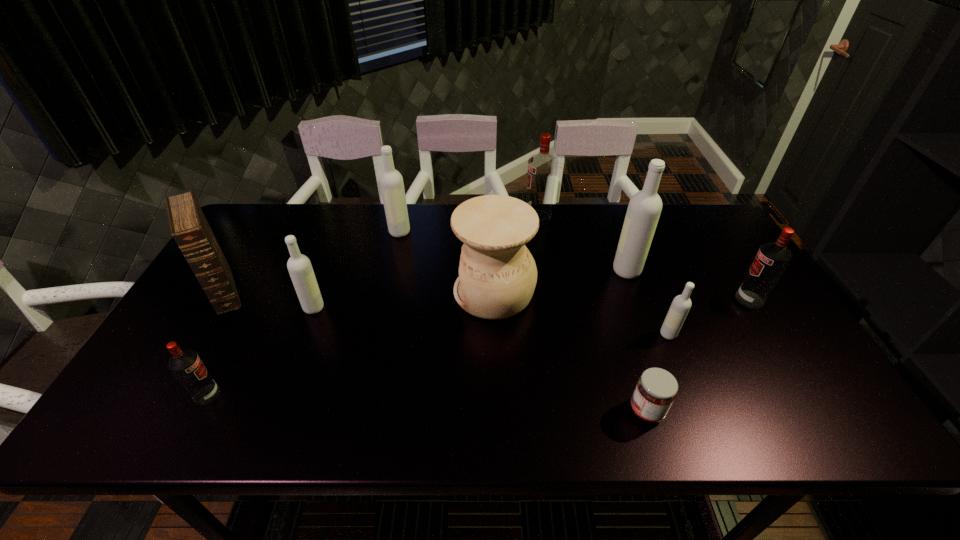
Locate an element on the screen. Image resolution: width=960 pixels, height=540 pixels. vacant region located on the front label of the fourth vodka from left to right is located at coordinates (447, 218).

The height and width of the screenshot is (540, 960). I want to click on free space located 0.090m on the front label of the fourth vodka from left to right, so click(x=497, y=218).

Find the location of a particular element. free space located 0.340m on the left of the seventh object from right to left is located at coordinates (285, 232).

Identify the location of vacant space situated on the back of the Bible. The height and width of the screenshot is (540, 960). (267, 220).

Locate an element on the screen. The width and height of the screenshot is (960, 540). vacant space located at the open side of the pottery is located at coordinates (369, 292).

The height and width of the screenshot is (540, 960). I want to click on free space located 0.390m at the open side of the pottery, so (x=316, y=292).

The width and height of the screenshot is (960, 540). Identify the location of vacant space located 0.380m at the open side of the pottery. (319, 292).

I want to click on free spot located 0.310m on the right of the leftmost white vodka, so (438, 308).

Find the location of a particular element. The image size is (960, 540). free spot located 0.250m on the front label of the second farthest red vodka is located at coordinates (646, 299).

Find the location of a particular element. vacant space situated 0.160m on the front label of the second farthest red vodka is located at coordinates [x=678, y=299].